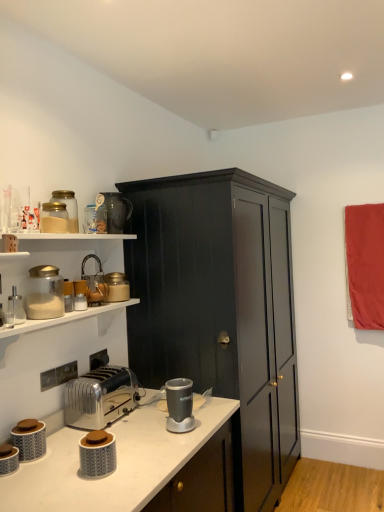
Question: From the image's perspective, is matte gray canister at lower left, the 10th appliance when ordered from top to bottom, under red fabric curtain at right?

Choices:
 (A) no
 (B) yes

Answer: (B)

Question: From a real-world perspective, is matte gray canister at lower left, the 10th appliance when ordered from top to bottom, beneath red fabric curtain at right?

Choices:
 (A) yes
 (B) no

Answer: (A)

Question: Is red fabric curtain at right completely or partially inside matte gray canister at lower left, arranged as the 2th appliance when ordered from the bottom?

Choices:
 (A) no
 (B) yes

Answer: (A)

Question: Does matte gray canister at lower left, arranged as the 2th appliance when ordered from the bottom, have a smaller size compared to red fabric curtain at right?

Choices:
 (A) no
 (B) yes

Answer: (B)

Question: Is matte gray canister at lower left, arranged as the 2th appliance when ordered from the bottom, to the left of red fabric curtain at right from the viewer's perspective?

Choices:
 (A) no
 (B) yes

Answer: (B)

Question: Could you tell me if matte gray canister at lower left, arranged as the 2th appliance when ordered from the bottom, is turned towards red fabric curtain at right?

Choices:
 (A) yes
 (B) no

Answer: (B)

Question: Can you confirm if dark wood cabinet at center is wider than metallic faucet at upper left, positioned as the ninth appliance in bottom-to-top order?

Choices:
 (A) no
 (B) yes

Answer: (B)

Question: Is dark wood cabinet at center not close to metallic faucet at upper left, positioned as the ninth appliance in bottom-to-top order?

Choices:
 (A) yes
 (B) no

Answer: (B)

Question: Is dark wood cabinet at center behind metallic faucet at upper left, the third appliance viewed from the top?

Choices:
 (A) no
 (B) yes

Answer: (B)

Question: Does dark wood cabinet at center have a lesser width compared to metallic faucet at upper left, positioned as the ninth appliance in bottom-to-top order?

Choices:
 (A) yes
 (B) no

Answer: (B)

Question: Would you say dark wood cabinet at center is outside metallic faucet at upper left, the third appliance viewed from the top?

Choices:
 (A) yes
 (B) no

Answer: (A)

Question: Is dark wood cabinet at center closer to camera compared to metallic faucet at upper left, the third appliance viewed from the top?

Choices:
 (A) no
 (B) yes

Answer: (A)

Question: Does matte glass jar at upper left, the 11th appliance ordered from the bottom, have a greater width compared to metallic faucet at upper left, the third appliance viewed from the top?

Choices:
 (A) yes
 (B) no

Answer: (B)